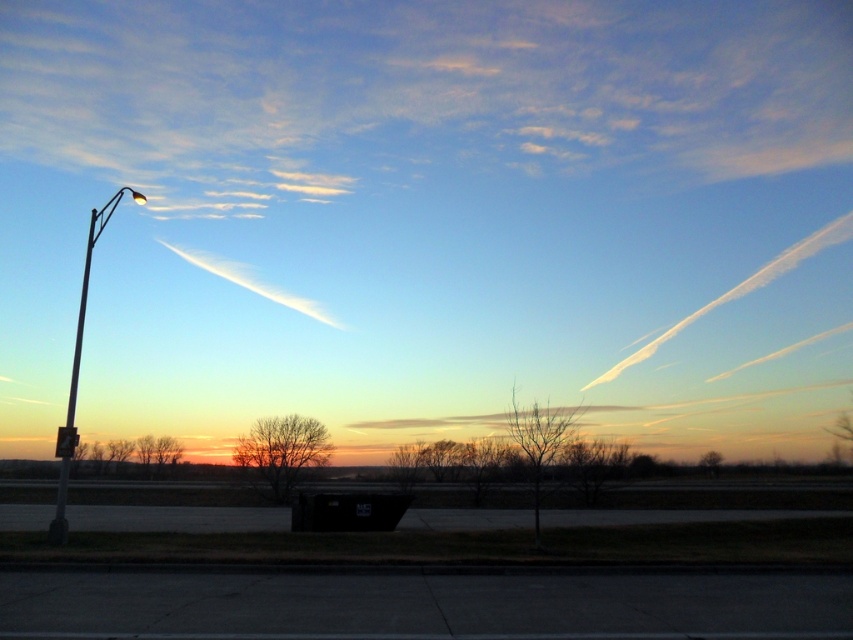
Question: Is white cotton cloud at upper right behind white cotton cloud at upper center?

Choices:
 (A) yes
 (B) no

Answer: (A)

Question: Estimate the real-world distances between objects in this image. Which object is farther from the translucent white cloud at center?

Choices:
 (A) white metallic pole at left
 (B) silver metallic pole at left
 (C) white cotton cloud at upper right

Answer: (B)

Question: Does white cotton cloud at upper center appear on the left side of translucent white cloud at center?

Choices:
 (A) yes
 (B) no

Answer: (A)

Question: Which object is the farthest from the white cotton cloud at upper center?

Choices:
 (A) white cotton cloud at upper right
 (B) silver metallic pole at left

Answer: (A)

Question: Does white metallic pole at left appear on the left side of silver metallic pole at left?

Choices:
 (A) yes
 (B) no

Answer: (B)

Question: Which of the following is the farthest from the observer?

Choices:
 (A) (850, 221)
 (B) (310, 305)
 (C) (80, 305)
 (D) (83, 320)

Answer: (A)